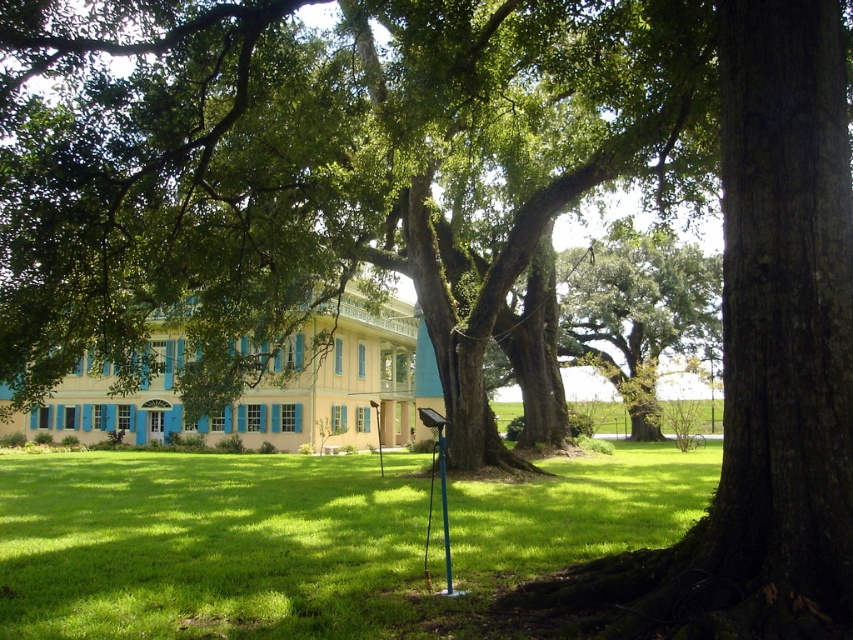
You are planning to place a new bench in the garden. The bench requires at least 3 meters of space to accommodate visitors comfortably. Given the green leafy tree at center and the green plastic pole at center, which object would you choose to position the bench next to, and why?

The green leafy tree at center has a larger width than the green plastic pole at center, so positioning the bench next to the green plastic pole at center would provide more space for visitors since it occupies less area.